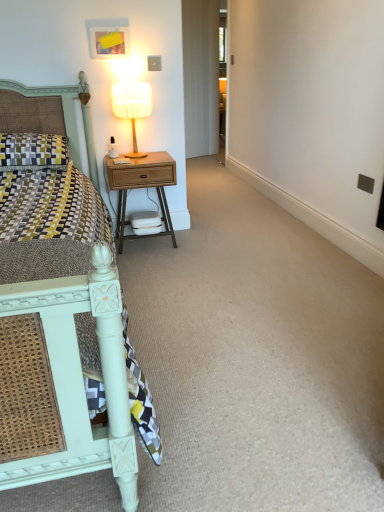
Question: Is patterned fabric pillow at left taller or shorter than woodenmaterial/texturenightstand at left?

Choices:
 (A) tall
 (B) short

Answer: (B)

Question: From the image's perspective, is patterned fabric pillow at left above or below woodenmaterial/texturenightstand at left?

Choices:
 (A) below
 (B) above

Answer: (B)

Question: Which is nearer to the white fabric lampshade at upper right?

Choices:
 (A) matte white bed at left
 (B) woodenmaterial/texturenightstand at left
 (C) patterned fabric pillow at left

Answer: (B)

Question: Which of these objects is positioned closest to the patterned fabric pillow at left?

Choices:
 (A) white fabric lampshade at upper right
 (B) woodenmaterial/texturenightstand at left
 (C) matte white bed at left

Answer: (B)